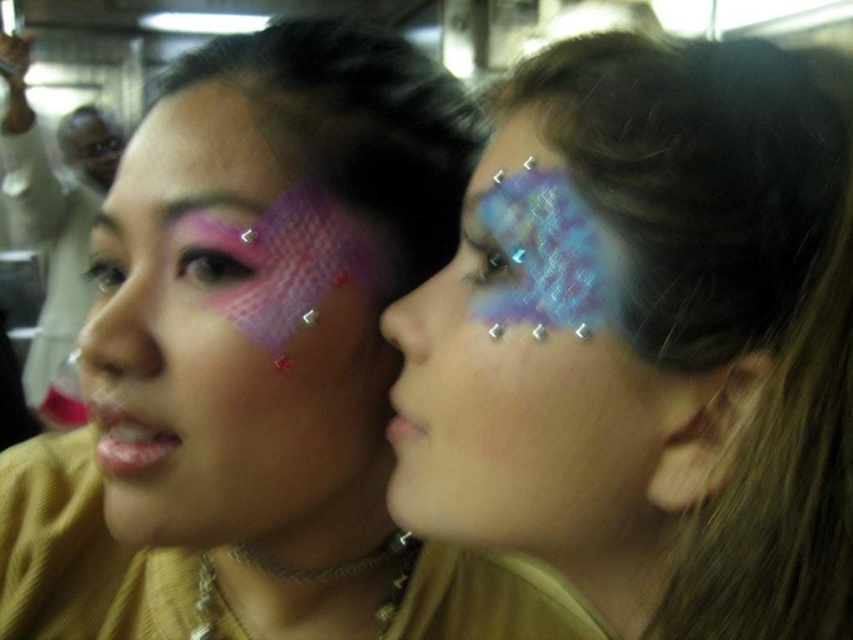
Which of these two, shiny metallic face paint at right or matte pink mesh face paint at left, stands taller?

matte pink mesh face paint at left

Who is more forward, (468, 188) or (74, 298)?

Point (468, 188)

Which is behind, point (416, 486) or point (61, 252)?

Point (61, 252)

Locate an element on the screen. Image resolution: width=853 pixels, height=640 pixels. shiny metallic face paint at right is located at coordinates (527, 372).

At what (x,y) coordinates should I click in order to perform the action: click on matte pink mesh nose at left. Please return your answer as a coordinate pair (x, y). The height and width of the screenshot is (640, 853). Looking at the image, I should click on (119, 324).

Who is shorter, matte pink mesh nose at left or matte pink lipstick at lower center?

matte pink lipstick at lower center is shorter.

Who is more forward, (144, 292) or (397, 410)?

Positioned in front is point (397, 410).

Identify the location of matte pink mesh nose at left. This screenshot has height=640, width=853. (119, 324).

Measure the distance between matte pink mesh face paint at upper center and matte pink mesh face paint at left.

matte pink mesh face paint at upper center and matte pink mesh face paint at left are 1.88 meters apart.

Who is positioned more to the right, matte pink mesh face paint at upper center or matte pink mesh face paint at left?

From the viewer's perspective, matte pink mesh face paint at upper center appears more on the right side.

Who is more forward, (303, 193) or (67, 204)?

Point (303, 193) is more forward.

Find the location of a particular element. Image resolution: width=853 pixels, height=640 pixels. matte pink mesh face paint at upper center is located at coordinates (265, 365).